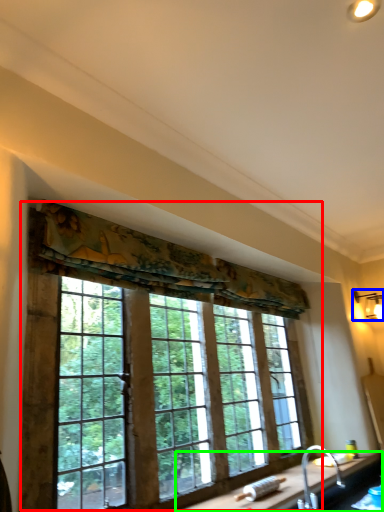
Question: Based on their relative distances, which object is nearer to window (highlighted by a red box)? Choose from light fixture (highlighted by a blue box) and counter top (highlighted by a green box).

Choices:
 (A) light fixture
 (B) counter top

Answer: (B)